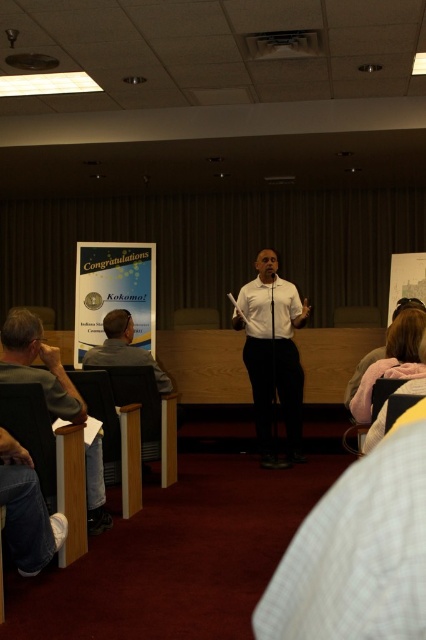
Looking at this image, does white smooth shirt at center come behind matte gray shirt at lower left?

Yes, white smooth shirt at center is further from the viewer.

What do you see at coordinates (273, 353) in the screenshot? This screenshot has height=640, width=426. I see `white smooth shirt at center` at bounding box center [273, 353].

Who is more distant from viewer, (252, 381) or (43, 355)?

Positioned behind is point (252, 381).

Locate an element on the screen. The height and width of the screenshot is (640, 426). white smooth shirt at center is located at coordinates (273, 353).

Where is `matte gray shirt at lower left`? matte gray shirt at lower left is located at coordinates (37, 368).

Can you confirm if matte gray shirt at lower left is taller than blonde hair at lower right?

Yes, matte gray shirt at lower left is taller than blonde hair at lower right.

Between point (34, 324) and point (420, 326), which one is positioned in front?

Point (420, 326) is more forward.

Where is `matte gray shirt at lower left`? Image resolution: width=426 pixels, height=640 pixels. matte gray shirt at lower left is located at coordinates (37, 368).

Can you confirm if matte gray shirt at lower left is taller than gray fabric chair at left?

Indeed, matte gray shirt at lower left has a greater height compared to gray fabric chair at left.

Which of these two, matte gray shirt at lower left or gray fabric chair at left, stands shorter?

With less height is gray fabric chair at left.

Between point (37, 369) and point (112, 323), which one is positioned in front?

Positioned in front is point (37, 369).

The image size is (426, 640). I want to click on matte gray shirt at lower left, so click(x=37, y=368).